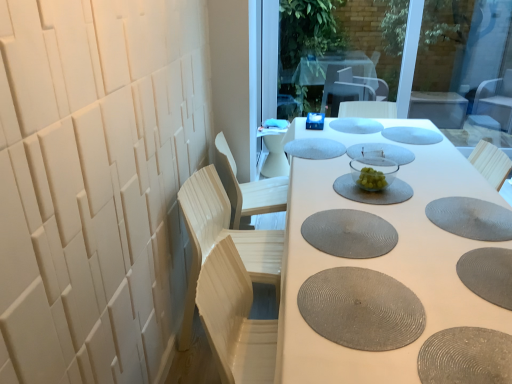
Locate an element on the screen. The height and width of the screenshot is (384, 512). vacant space to the right of gray textured placemat at center, which is counted as the fourth manhole cover, starting from the front is located at coordinates (426, 227).